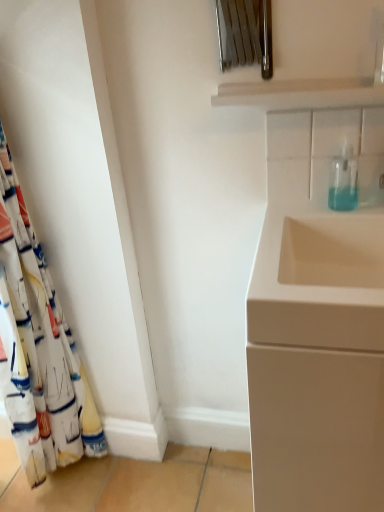
Question: Is white fabric curtain at left facing towards transparent plastic soap dispenser at upper right?

Choices:
 (A) yes
 (B) no

Answer: (A)

Question: Would you say white fabric curtain at left is a long distance from transparent plastic soap dispenser at upper right?

Choices:
 (A) yes
 (B) no

Answer: (B)

Question: Can you confirm if white fabric curtain at left is shorter than transparent plastic soap dispenser at upper right?

Choices:
 (A) no
 (B) yes

Answer: (A)

Question: Is white fabric curtain at left at the right side of transparent plastic soap dispenser at upper right?

Choices:
 (A) no
 (B) yes

Answer: (A)

Question: Does white fabric curtain at left have a smaller size compared to transparent plastic soap dispenser at upper right?

Choices:
 (A) no
 (B) yes

Answer: (A)

Question: Is white fabric curtain at left looking in the opposite direction of transparent plastic soap dispenser at upper right?

Choices:
 (A) yes
 (B) no

Answer: (B)

Question: Does matte white cabinet at right have a smaller size compared to transparent plastic soap dispenser at upper right?

Choices:
 (A) no
 (B) yes

Answer: (A)

Question: From a real-world perspective, is matte white cabinet at right positioned under transparent plastic soap dispenser at upper right based on gravity?

Choices:
 (A) yes
 (B) no

Answer: (A)

Question: Is matte white cabinet at right facing towards transparent plastic soap dispenser at upper right?

Choices:
 (A) yes
 (B) no

Answer: (B)

Question: Is the surface of matte white cabinet at right in direct contact with transparent plastic soap dispenser at upper right?

Choices:
 (A) yes
 (B) no

Answer: (B)

Question: Does matte white cabinet at right have a greater width compared to transparent plastic soap dispenser at upper right?

Choices:
 (A) yes
 (B) no

Answer: (A)

Question: Can you confirm if matte white cabinet at right is taller than transparent plastic soap dispenser at upper right?

Choices:
 (A) no
 (B) yes

Answer: (B)

Question: Would you consider matte white cabinet at right to be distant from white fabric curtain at left?

Choices:
 (A) no
 (B) yes

Answer: (A)